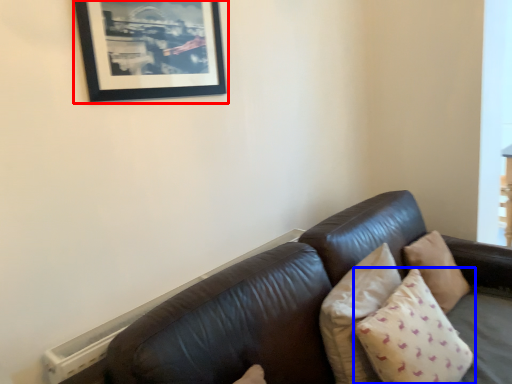
Question: Which point is further to the camera, picture frame (highlighted by a red box) or pillow (highlighted by a blue box)?

Choices:
 (A) picture frame
 (B) pillow

Answer: (A)